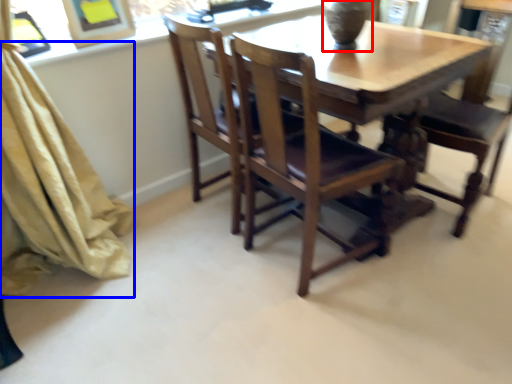
Question: Among these objects, which one is farthest to the camera, glass vase (highlighted by a red box) or curtain (highlighted by a blue box)?

Choices:
 (A) glass vase
 (B) curtain

Answer: (A)